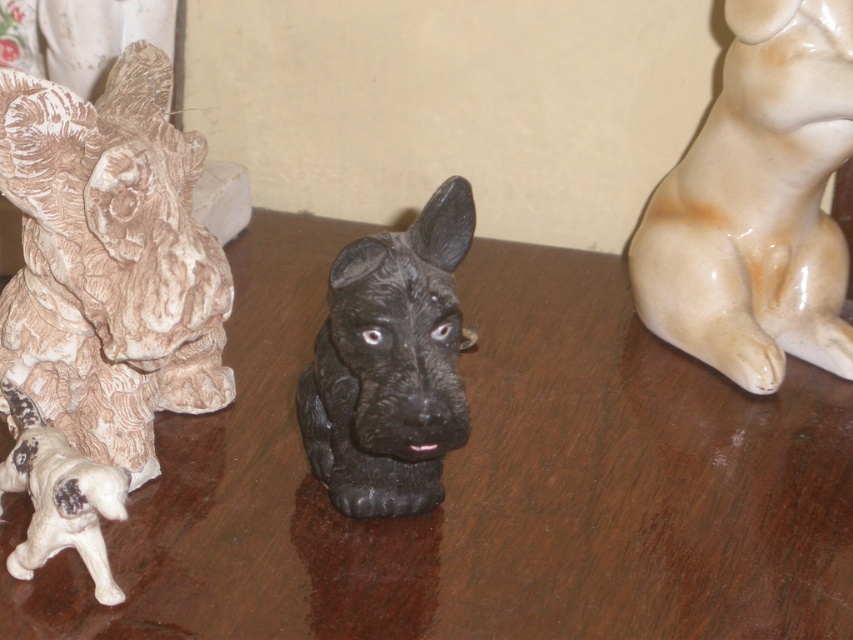
You are an art curator arranging a display of two white dogs. You have a white textured dog at left and a matte white dog at right. If you want to place a new figurine between them, where should it go based on their current positions?

The white textured dog at left is closer to the viewer than the matte white dog at right, so the new figurine should be placed between them along the depth axis, maintaining the existing spatial relationship.

You are organizing a display of ceramic figurines and need to place a new figurine between the matte white dog at right and the white matte dog at lower left. Based on their heights, which position should the new figurine be placed to ensure it doesn

The matte white dog at right is taller than the white matte dog at lower left. To maintain a height gradient, the new figurine should be placed between them at a height lower than the matte white dog at right but higher than the white matte dog at lower left.